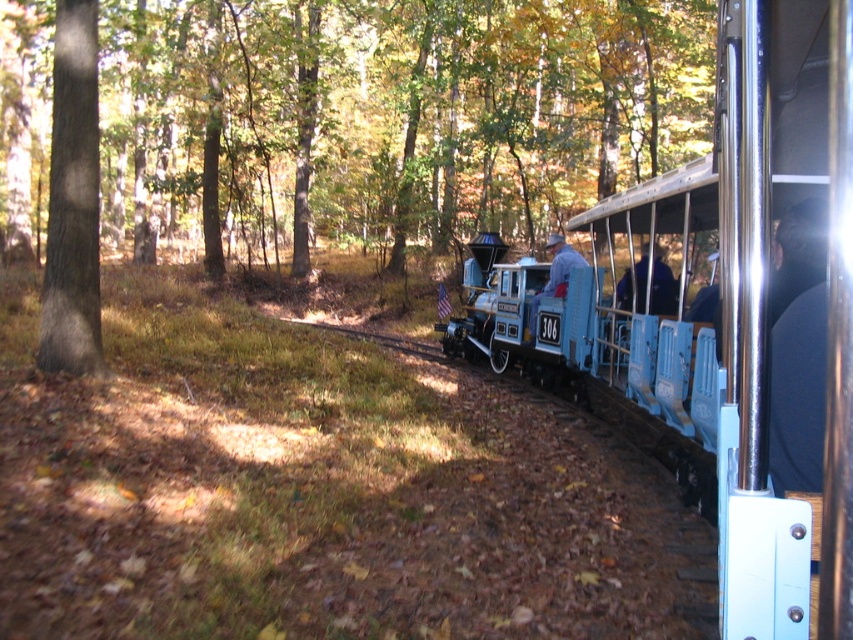
You are standing on the train tracks and see two points marked on the ground ahead of you. The first point is at coordinates point (674, 412) and the second is at point (587, 326). Which point is closer to you?

Point (674, 412) is closer to the viewer than point (587, 326).